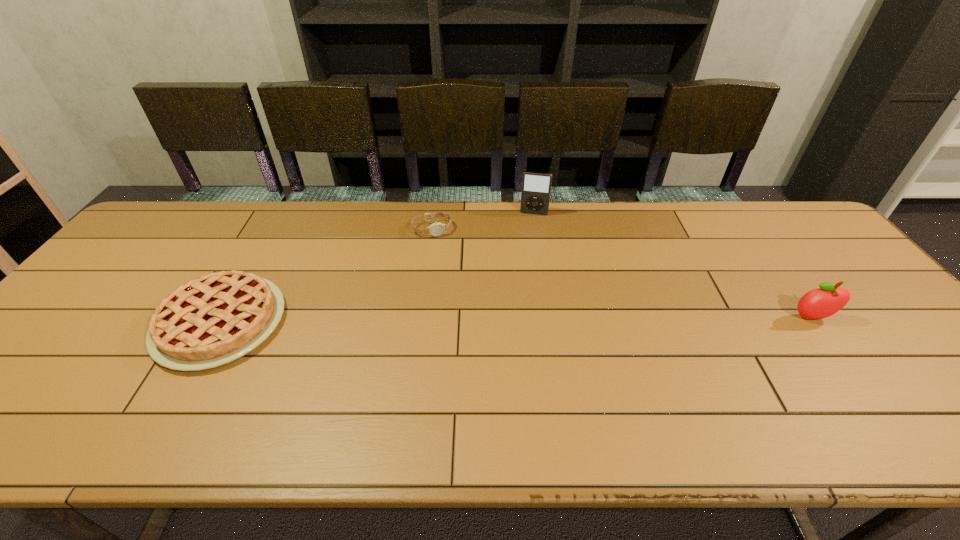
Locate an element on the screen. The width and height of the screenshot is (960, 540). vacant space located on the face of the third nearest object is located at coordinates (442, 252).

Where is `free space located on the face of the third nearest object`? The width and height of the screenshot is (960, 540). free space located on the face of the third nearest object is located at coordinates (469, 328).

Image resolution: width=960 pixels, height=540 pixels. Find the location of `vacant space situated on the front-facing side of the third object from left to right`. vacant space situated on the front-facing side of the third object from left to right is located at coordinates (524, 263).

Locate an element on the screen. The image size is (960, 540). free region located 0.250m on the front-facing side of the third object from left to right is located at coordinates (523, 265).

Find the location of `vacant space located 0.220m on the front-facing side of the third object from left to right`. vacant space located 0.220m on the front-facing side of the third object from left to right is located at coordinates (525, 259).

Where is `watch that is at the far edge`? Image resolution: width=960 pixels, height=540 pixels. watch that is at the far edge is located at coordinates (436, 229).

Identify the location of iPod at the far edge. (536, 186).

The height and width of the screenshot is (540, 960). What are the coordinates of `object located in the near edge section of the desktop` in the screenshot? It's located at (210, 321).

This screenshot has width=960, height=540. In order to click on object at the right edge in this screenshot , I will do `click(819, 303)`.

Find the location of `blank space at the far edge`. blank space at the far edge is located at coordinates [x=493, y=207].